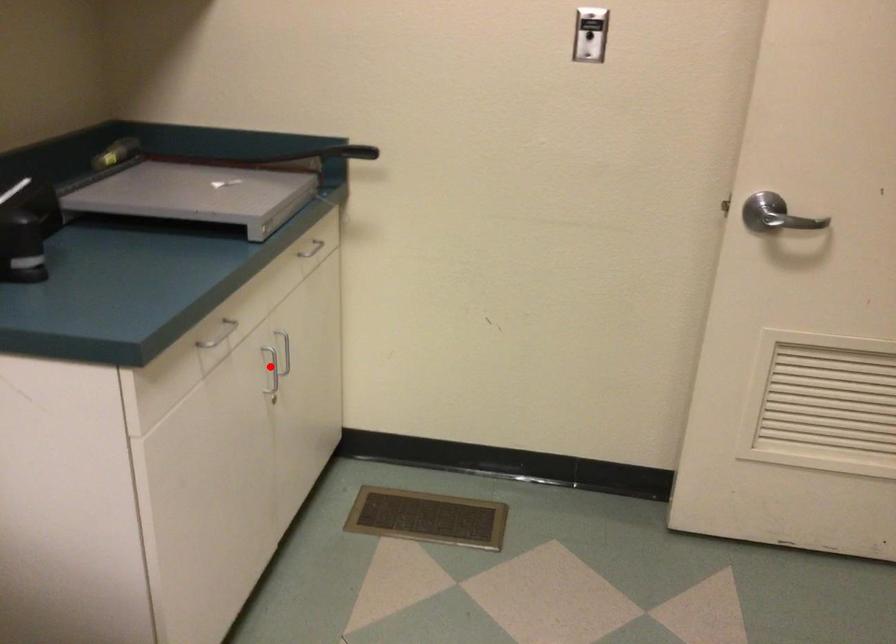
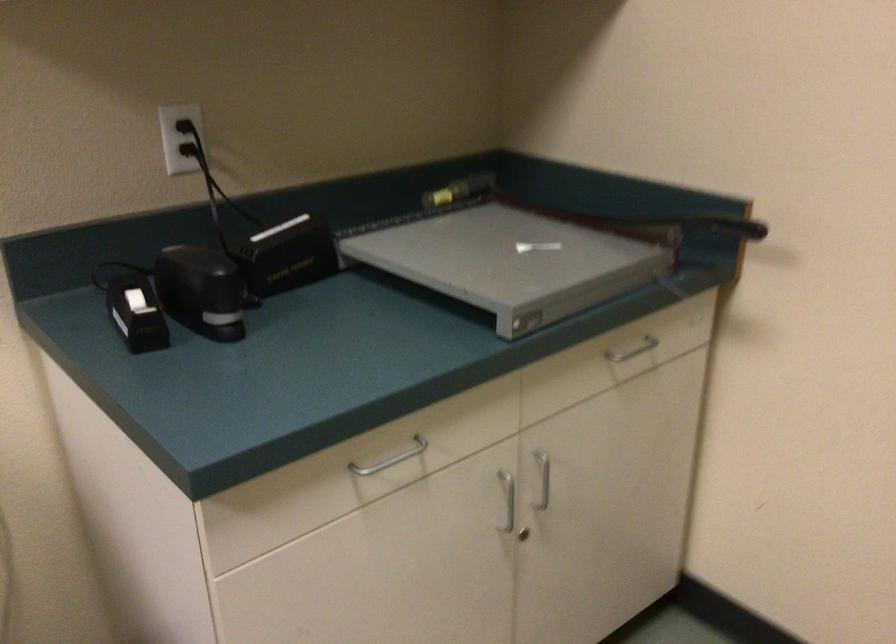
The point at the highlighted location is marked in the first image. Where is the corresponding point in the second image?

(507, 500)